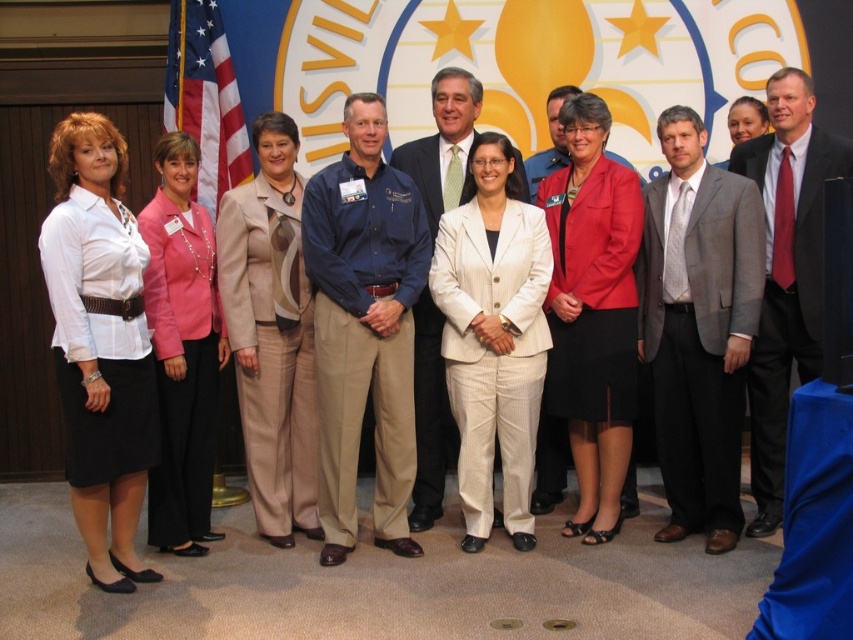
Question: Does blue cotton shirt at center appear over matte red blazer at center?

Choices:
 (A) yes
 (B) no

Answer: (B)

Question: Does pink fabric jacket at left appear over american flag at left?

Choices:
 (A) yes
 (B) no

Answer: (B)

Question: Among these points, which one is farthest from the camera?

Choices:
 (A) (792, 202)
 (B) (225, 128)
 (C) (294, 369)
 (D) (669, 212)

Answer: (B)

Question: Observing the image, what is the correct spatial positioning of white satin blouse at center in reference to pink fabric jacket at left?

Choices:
 (A) left
 (B) right

Answer: (A)

Question: Among these points, which one is nearest to the camera?

Choices:
 (A) (224, 88)
 (B) (270, 497)
 (C) (328, 518)

Answer: (C)

Question: Which point is farther from the camera taking this photo?

Choices:
 (A) (171, 516)
 (B) (212, 22)
 (C) (358, 99)
 (D) (108, 228)

Answer: (B)